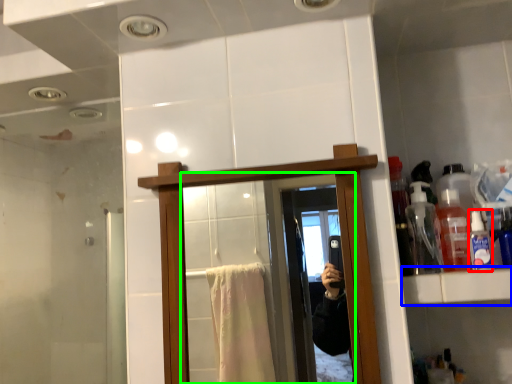
Question: Which object is positioned farthest from toiletry (highlighted by a red box)? Select from cabinet (highlighted by a blue box) and mirror (highlighted by a green box).

Choices:
 (A) cabinet
 (B) mirror

Answer: (B)